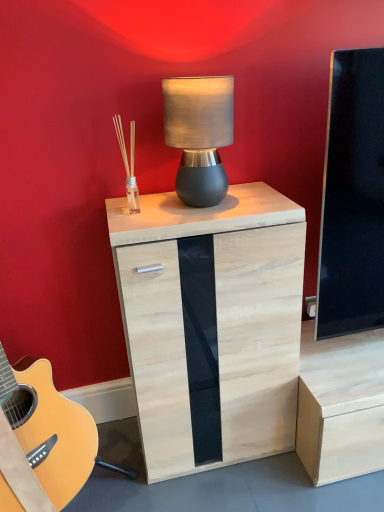
Question: Considering the positions of matte gray lamp at center and light wood/glass cabinet at center in the image, is matte gray lamp at center bigger or smaller than light wood/glass cabinet at center?

Choices:
 (A) small
 (B) big

Answer: (A)

Question: From the image's perspective, is matte gray lamp at center above or below light wood/glass cabinet at center?

Choices:
 (A) below
 (B) above

Answer: (B)

Question: From their relative heights in the image, would you say matte gray lamp at center is taller or shorter than light wood/glass cabinet at center?

Choices:
 (A) tall
 (B) short

Answer: (B)

Question: Would you say light wood/glass cabinet at center is to the left or to the right of matte gray lamp at center in the picture?

Choices:
 (A) right
 (B) left

Answer: (A)

Question: Would you say light wood/glass cabinet at center is inside or outside matte gray lamp at center?

Choices:
 (A) outside
 (B) inside

Answer: (A)

Question: From a real-world perspective, relative to matte gray lamp at center, is light wood/glass cabinet at center vertically above or below?

Choices:
 (A) above
 (B) below

Answer: (B)

Question: Looking at the image, does light wood/glass cabinet at center seem bigger or smaller compared to matte gray lamp at center?

Choices:
 (A) small
 (B) big

Answer: (B)